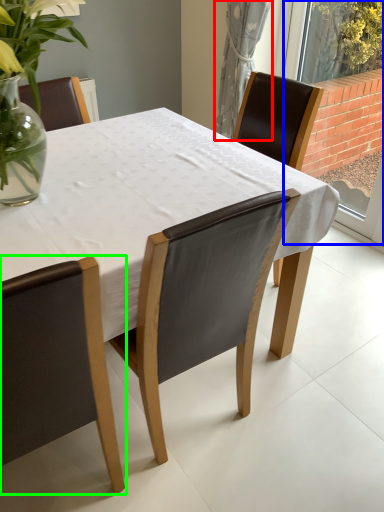
Question: Based on their relative distances, which object is nearer to curtain (highlighted by a red box)? Choose from window (highlighted by a blue box) and chair (highlighted by a green box).

Choices:
 (A) window
 (B) chair

Answer: (A)